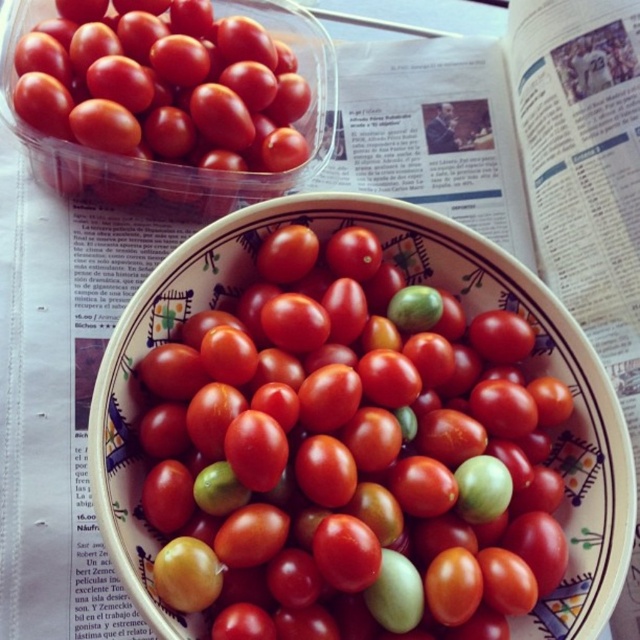
Question: Does green matte cherry tomato at center have a larger size compared to glossy plastic container at upper left?

Choices:
 (A) no
 (B) yes

Answer: (B)

Question: Which of the following is the closest to the observer?

Choices:
 (A) (268, 70)
 (B) (193, 484)

Answer: (B)

Question: Is green matte cherry tomato at center smaller than glossy plastic container at upper left?

Choices:
 (A) no
 (B) yes

Answer: (A)

Question: Which point is closer to the camera taking this photo?

Choices:
 (A) (236, 337)
 (B) (99, 170)

Answer: (A)

Question: Is green matte cherry tomato at center positioned at the back of glossy plastic container at upper left?

Choices:
 (A) no
 (B) yes

Answer: (A)

Question: Which of the following is the farthest from the observer?

Choices:
 (A) glossy plastic container at upper left
 (B) green matte cherry tomato at center

Answer: (A)